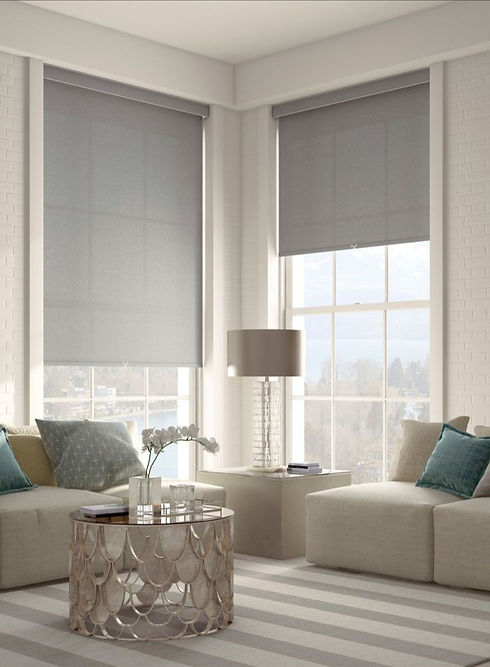
What are the coordinates of `sofa` in the screenshot? It's located at (417, 528), (458, 534).